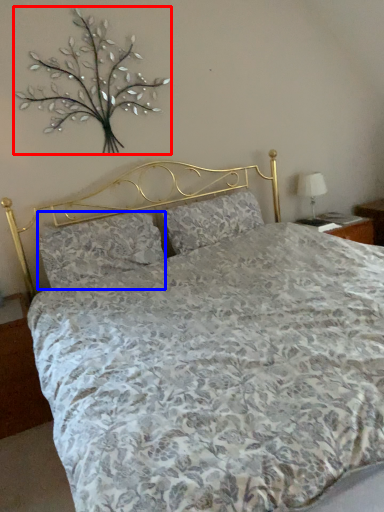
Question: Which object appears farthest to the camera in this image, floral arrangement (highlighted by a red box) or pillow (highlighted by a blue box)?

Choices:
 (A) floral arrangement
 (B) pillow

Answer: (B)